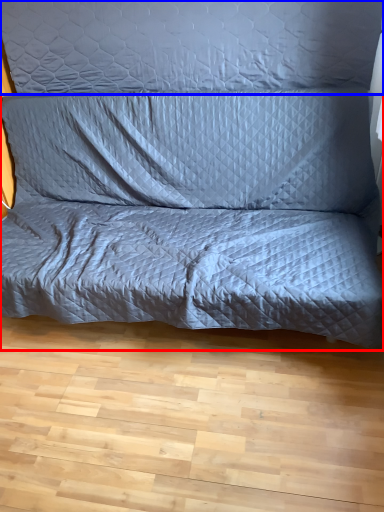
Question: Which object is closer to the camera taking this photo, studio couch (highlighted by a red box) or pillow (highlighted by a blue box)?

Choices:
 (A) studio couch
 (B) pillow

Answer: (A)